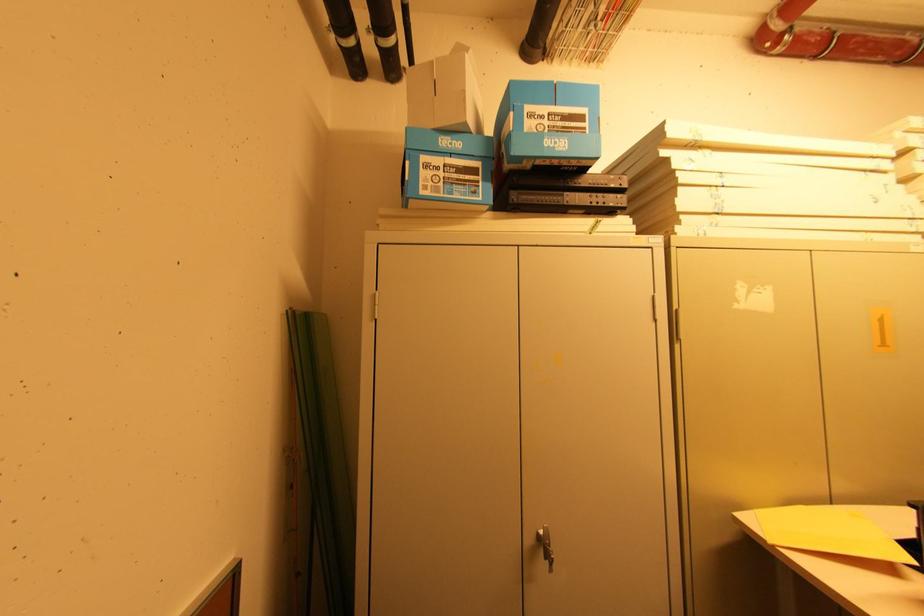
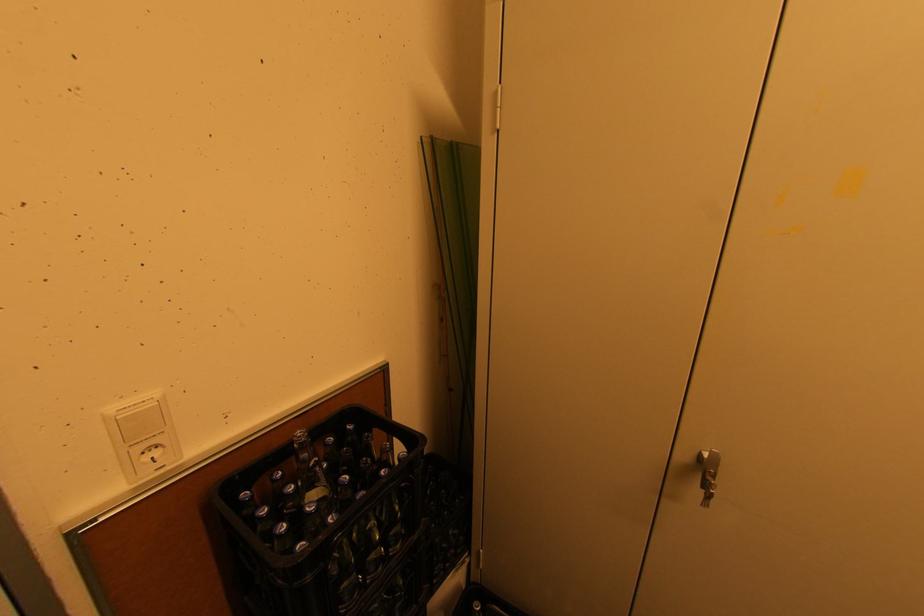
First-person continuous shooting, in which direction is the camera rotating?

The rotation direction of the camera is left-down.